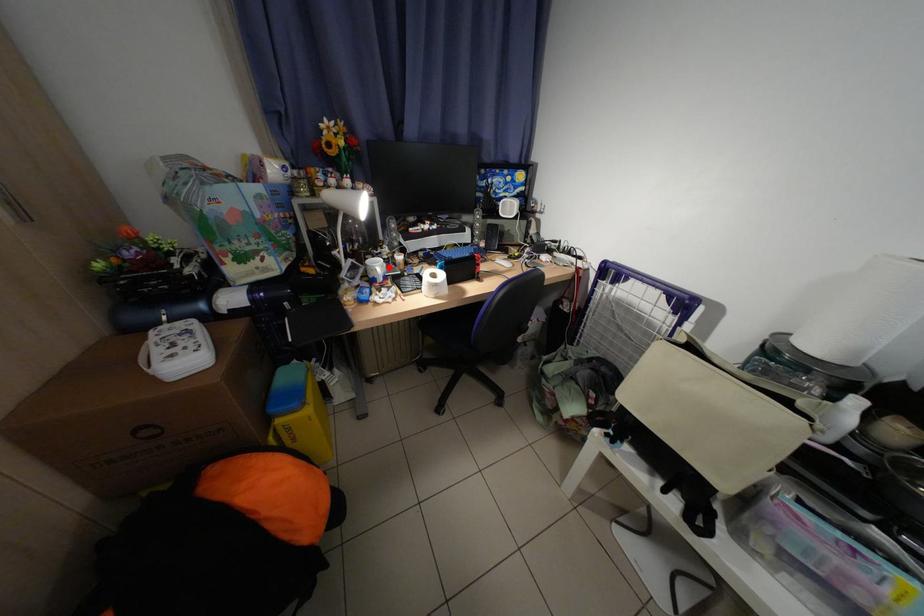
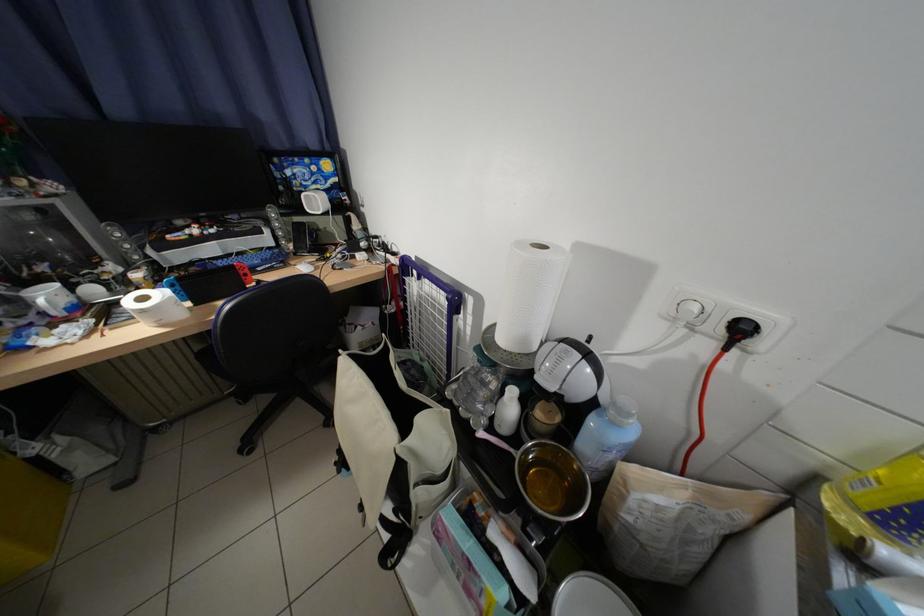
Locate, in the second image, the point that corresponds to the highlighted location in the first image.

(59, 297)